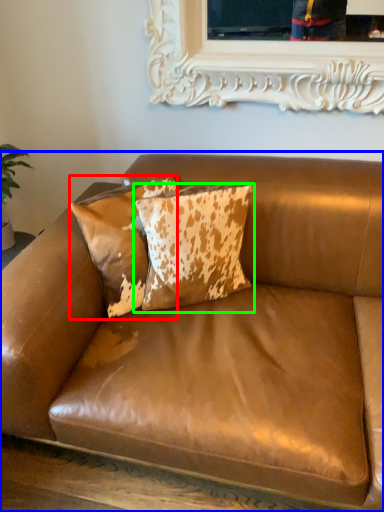
Question: Which is nearer to the pillow (highlighted by a red box)? studio couch (highlighted by a blue box) or pillow (highlighted by a green box).

Choices:
 (A) studio couch
 (B) pillow

Answer: (B)